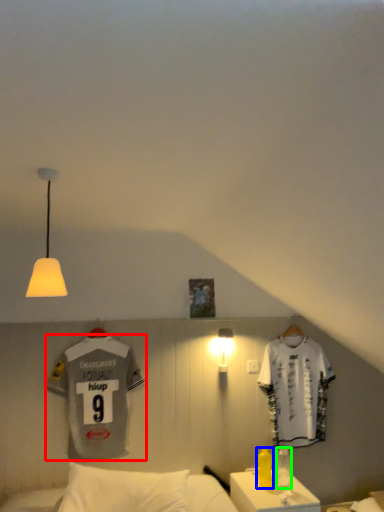
Question: Which object is positioned closest to sports uniform (highlighted by a red box)? Select from bottle (highlighted by a blue box) and bottle (highlighted by a green box).

Choices:
 (A) bottle
 (B) bottle

Answer: (A)